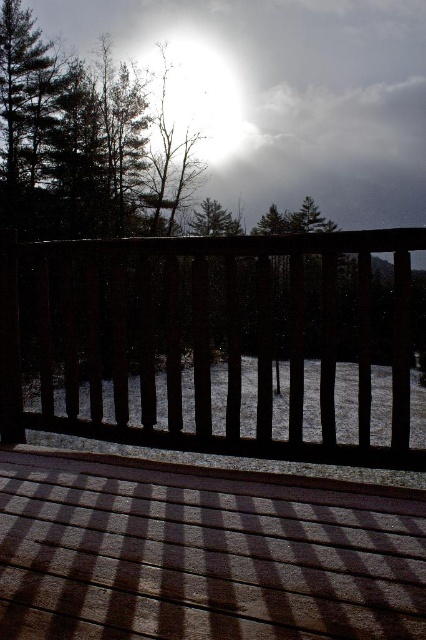
Question: Is the position of dark green textured tree at upper left more distant than that of green matte tree at center?

Choices:
 (A) yes
 (B) no

Answer: (B)

Question: Which object is closer to the camera taking this photo?

Choices:
 (A) bright white light at upper center
 (B) brown wooden balustrade at center
 (C) brown wooden deck at center
 (D) dark green textured tree at upper left

Answer: (C)

Question: Can you confirm if brown wooden deck at center is positioned to the right of dark green textured tree at upper left?

Choices:
 (A) yes
 (B) no

Answer: (A)

Question: Which object is the farthest from the brown wooden deck at center?

Choices:
 (A) bright white light at upper center
 (B) brown wooden balustrade at center

Answer: (A)

Question: Is brown wooden balustrade at center positioned in front of dark green textured tree at upper left?

Choices:
 (A) no
 (B) yes

Answer: (B)

Question: Which of the following is the farthest from the observer?

Choices:
 (A) brown wooden balustrade at center
 (B) brown wooden deck at center
 (C) bright white light at upper center
 (D) dark green textured tree at upper left

Answer: (C)